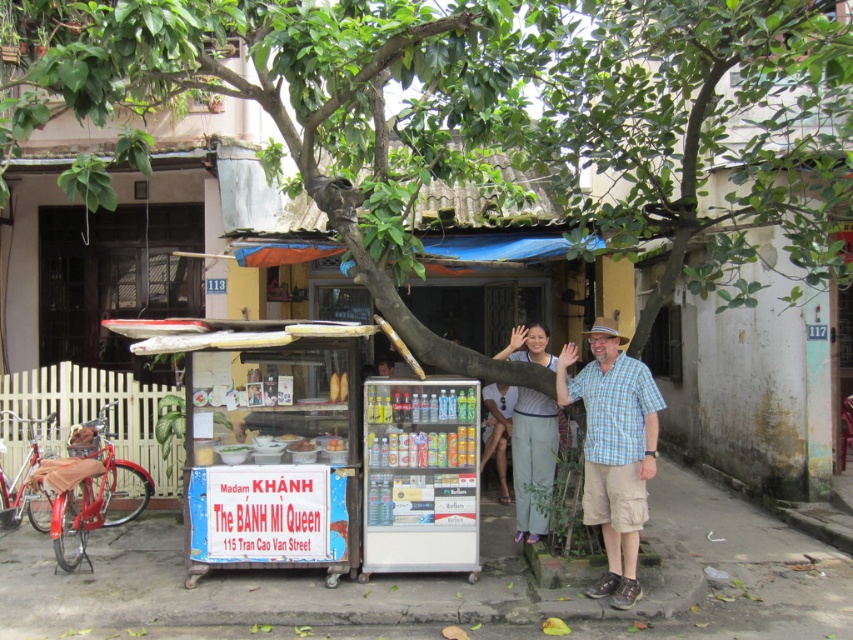
In the scene shown: Can you confirm if plaid cotton shirt at center is positioned above light blue cotton pants at center?

Actually, plaid cotton shirt at center is below light blue cotton pants at center.

In the scene shown: Between plaid cotton shirt at center and light blue cotton pants at center, which one is positioned higher?

light blue cotton pants at center

Is point (624, 580) positioned after point (517, 518)?

No, it is in front of (517, 518).

Image resolution: width=853 pixels, height=640 pixels. Identify the location of plaid cotton shirt at center. (613, 451).